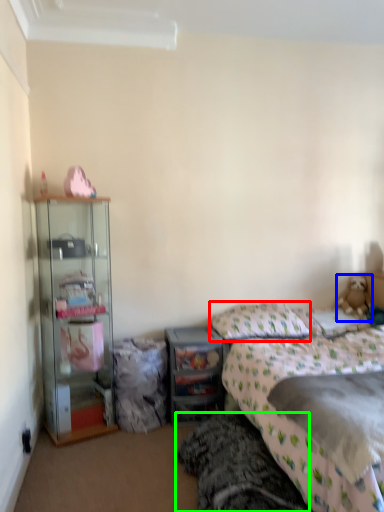
Question: Based on their relative distances, which object is farther from pillow (highlighted by a red box)? Choose from teddy bear (highlighted by a blue box) and bed frame (highlighted by a green box).

Choices:
 (A) teddy bear
 (B) bed frame

Answer: (B)